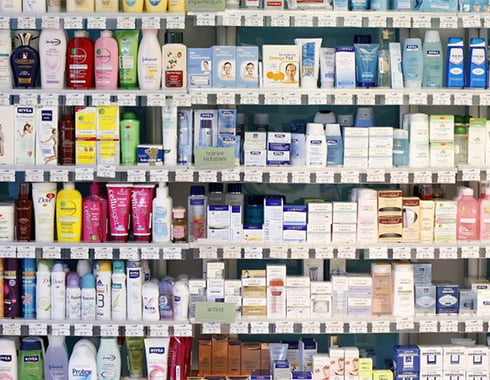
At what (x,y) coordinates should I click in order to perform the action: click on green card on front of shelf. Please return your answer as a coordinate pair (x, y). The height and width of the screenshot is (380, 490). Looking at the image, I should click on click(x=219, y=312), click(x=226, y=157), click(x=211, y=6).